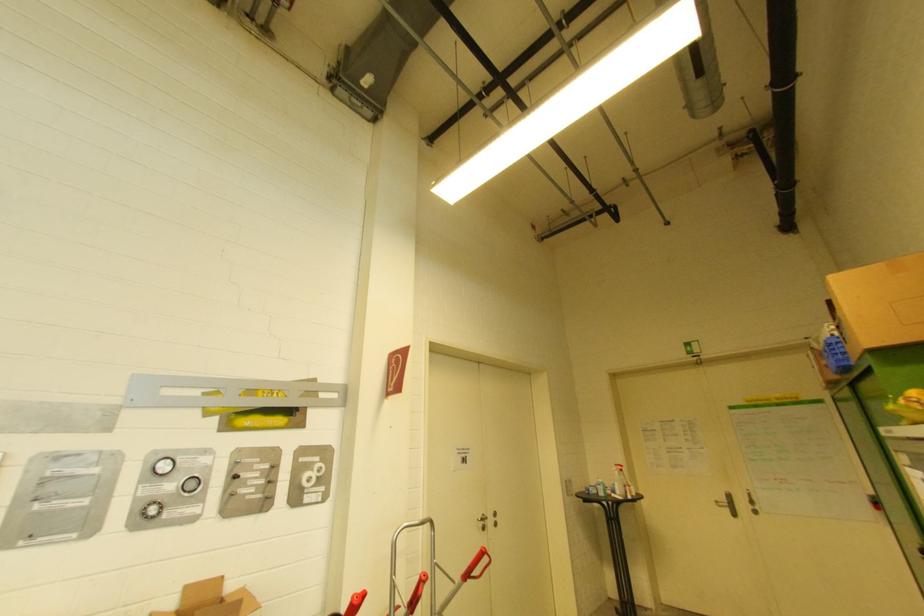
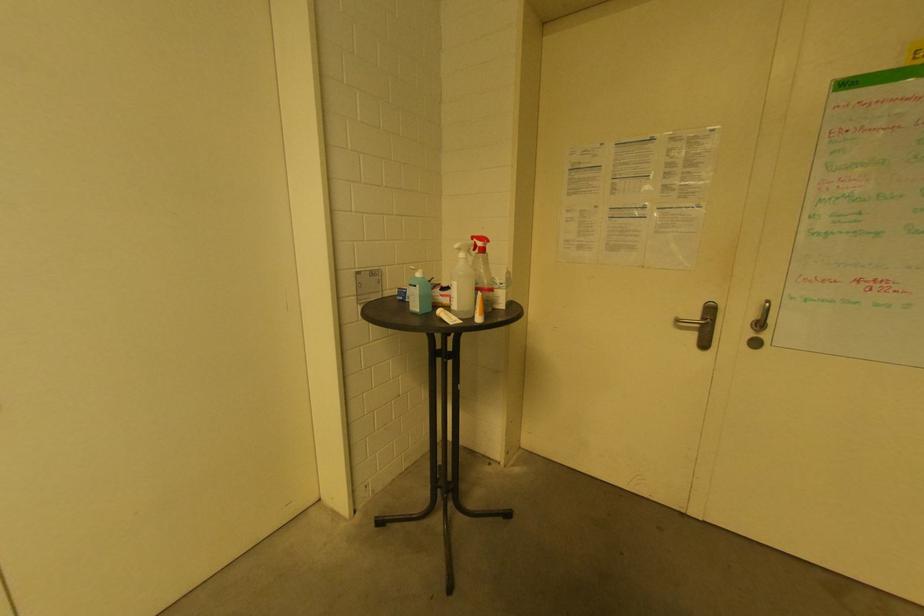
The point at (622,469) is marked in the first image. Where is the corresponding point in the second image?

(481, 245)